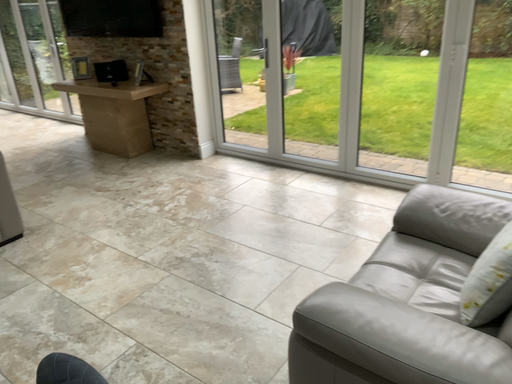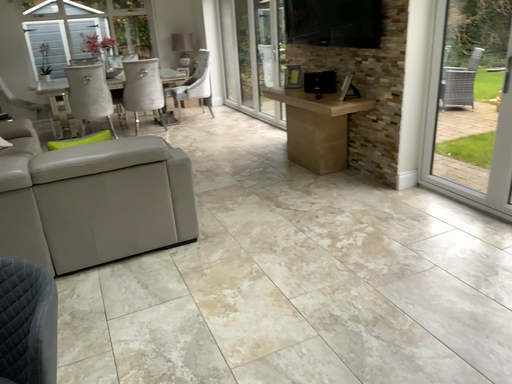
Question: Which way did the camera rotate in the video?

Choices:
 (A) rotated right
 (B) rotated left

Answer: (B)